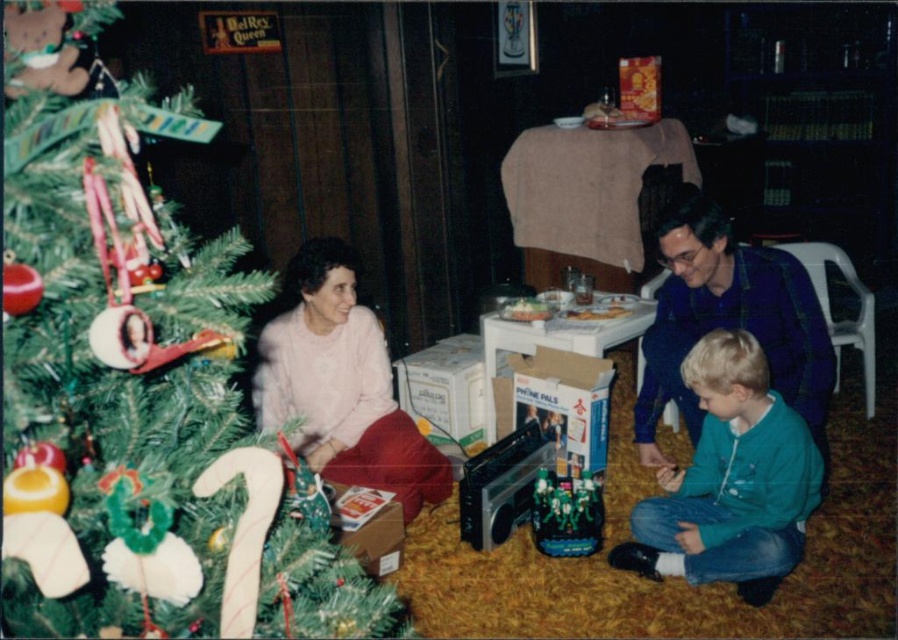
Based on the photo, does green matte christmas tree at left come in front of pink fabric at lower left?

Yes, it is.

Who is positioned more to the left, green matte christmas tree at left or pink fabric at lower left?

pink fabric at lower left

Is point (25, 468) farther from viewer compared to point (386, 476)?

No.

Locate an element on the screen. green matte christmas tree at left is located at coordinates (137, 385).

Who is taller, teal fleece jacket at lower right or pink fabric at lower left?

pink fabric at lower left is taller.

Is teal fleece jacket at lower right shorter than pink fabric at lower left?

Yes, teal fleece jacket at lower right is shorter than pink fabric at lower left.

Who is more forward, (800, 497) or (409, 452)?

Point (800, 497) is in front.

Find the location of a particular element. This screenshot has height=640, width=898. teal fleece jacket at lower right is located at coordinates (729, 481).

Between green matte christmas tree at left and teal fleece jacket at lower right, which one has less height?

teal fleece jacket at lower right

What do you see at coordinates (137, 385) in the screenshot? I see `green matte christmas tree at left` at bounding box center [137, 385].

The image size is (898, 640). I want to click on green matte christmas tree at left, so click(137, 385).